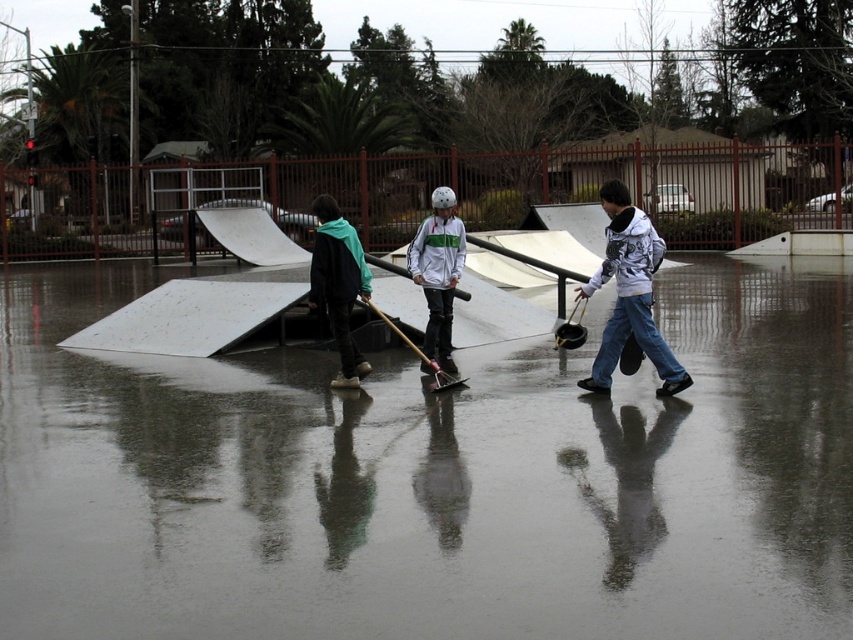
You are a drone operator trying to capture a photo of the reflective wet pavement at center and the white matte jacket at center. Which object should you focus on first if you want to ensure both are in the frame without moving the drone?

You should focus on the white matte jacket at center first because the reflective wet pavement at center is located above it, so by centering the jacket, the pavement will naturally be in the frame above.

You are a photographer at the skatepark and need to capture both the white printed hoodie at center and the white matte jacket at center in a single frame. Given their sizes, which one might appear closer to the camera to maintain both in focus?

The white printed hoodie at center is larger in size than the white matte jacket at center, so to keep both in focus, the white printed hoodie at center should be positioned closer to the camera.

Based on the photo, you are a skateboarder trying to reach the ramp located behind the metallic silver skateboard at center. According to the scene, can you safely skate around the reflective wet pavement at center to get to the ramp?

The reflective wet pavement at center is in front of the metallic silver skateboard at center, so you would need to go around it to reach the ramp. However, since the pavement is wet and reflective, it might be slippery, posing a safety risk. Proceed with caution.